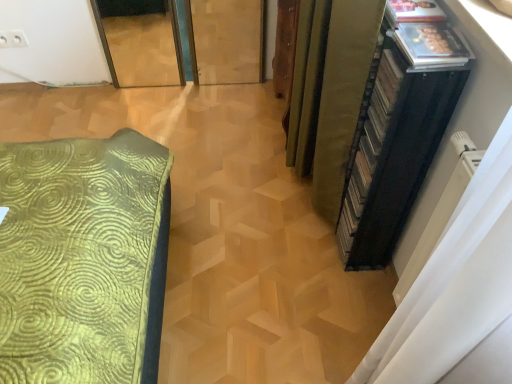
Locate an element on the screen. vacant space situated on the left part of green fabric curtain at right is located at coordinates (241, 187).